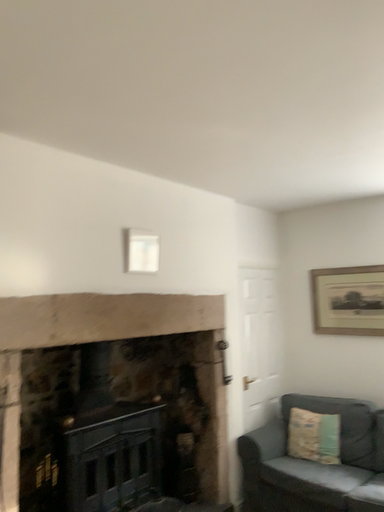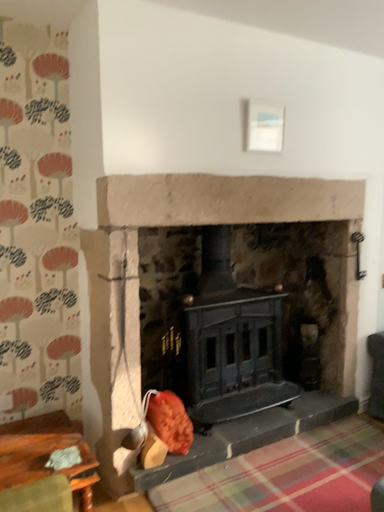
Question: Which way did the camera rotate in the video?

Choices:
 (A) rotated right
 (B) rotated left

Answer: (B)